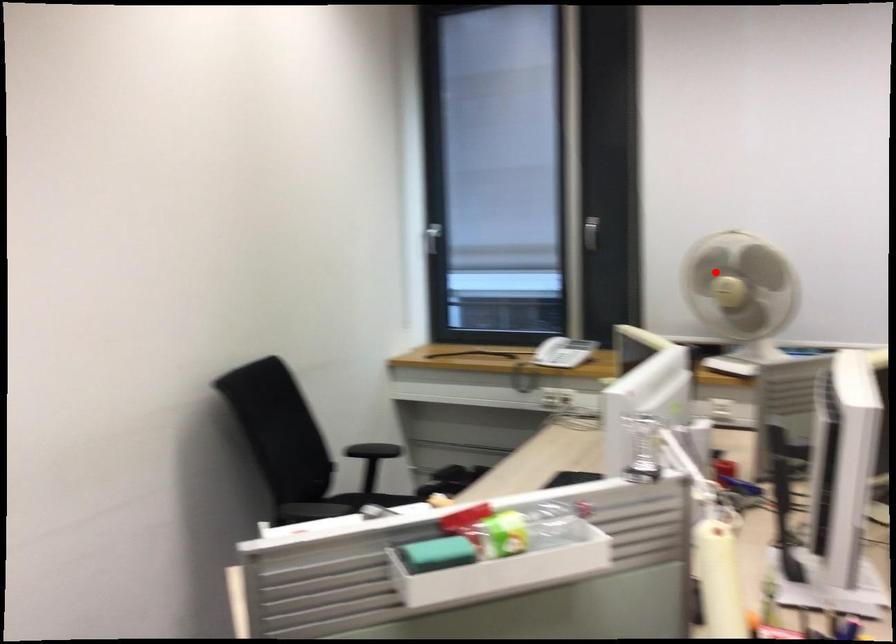
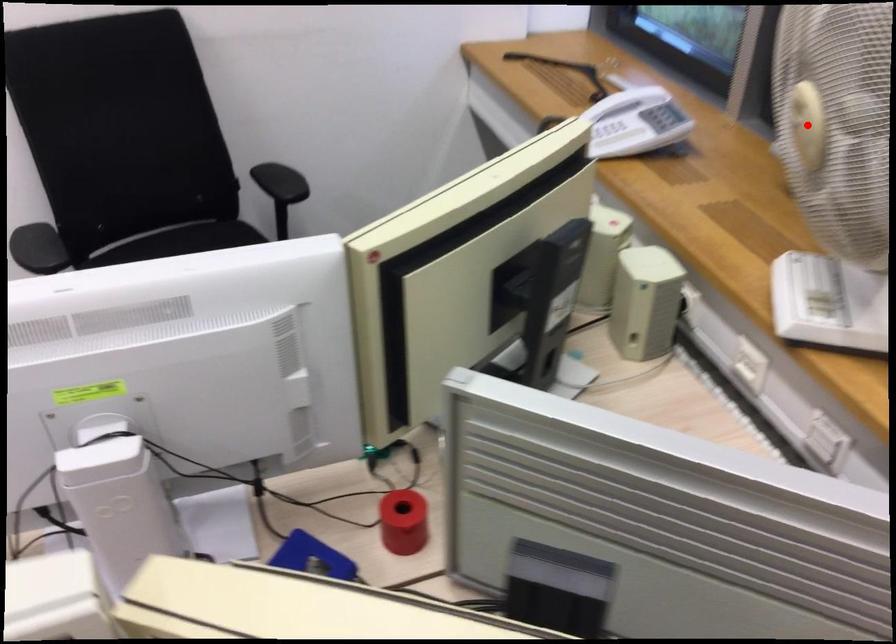
I am providing you with two images of the same scene from different viewpoints. A red point is marked on the first image and another point is marked on the second image. Are the points marked in image1 and image2 representing the same 3D position?

Yes